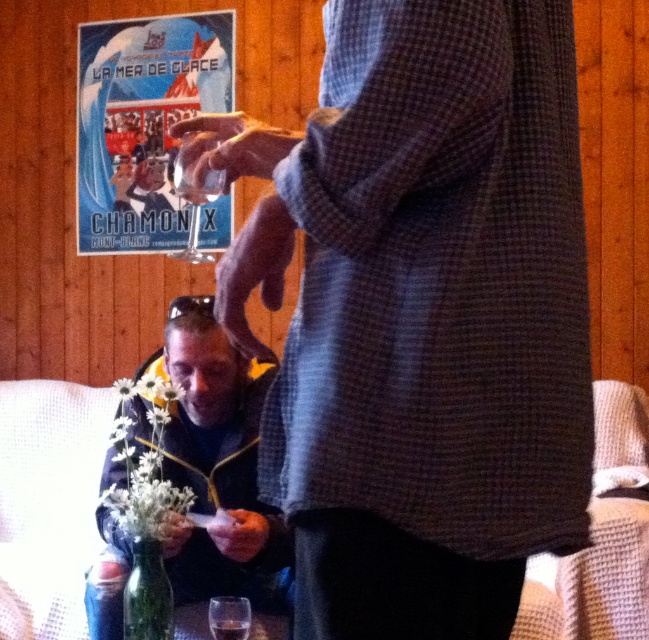
Does transparent glass at lower center have a greater height compared to transparent glass at upper center?

Indeed, transparent glass at lower center has a greater height compared to transparent glass at upper center.

Is point (221, 627) less distant than point (221, 189)?

That is False.

Where is `transparent glass at lower center`? This screenshot has width=649, height=640. transparent glass at lower center is located at coordinates tap(228, 618).

Where is `transparent glass at lower center`? transparent glass at lower center is located at coordinates (228, 618).

Locate an element on the screen. This screenshot has height=640, width=649. transparent glass at lower center is located at coordinates (228, 618).

Between transparent glass at lower center and translucent glass at lower center, which one appears on the left side from the viewer's perspective?

Positioned to the left is transparent glass at lower center.

At what (x,y) coordinates should I click in order to perform the action: click on transparent glass at lower center. Please return your answer as a coordinate pair (x, y). Looking at the image, I should click on (228, 618).

Can you confirm if checkered fabric shirt at center is positioned to the left of matte paper poster at upper left?

Incorrect, checkered fabric shirt at center is not on the left side of matte paper poster at upper left.

Can you confirm if checkered fabric shirt at center is positioned to the right of matte paper poster at upper left?

Indeed, checkered fabric shirt at center is positioned on the right side of matte paper poster at upper left.

Between point (469, 580) and point (147, 243), which one is positioned in front?

Point (469, 580)

The width and height of the screenshot is (649, 640). I want to click on checkered fabric shirt at center, so click(x=422, y=314).